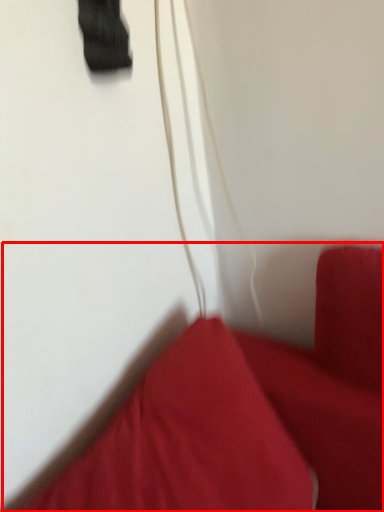
Question: From the image, what is the correct spatial relationship of furniture (annotated by the red box) in relation to string?

Choices:
 (A) left
 (B) right

Answer: (A)